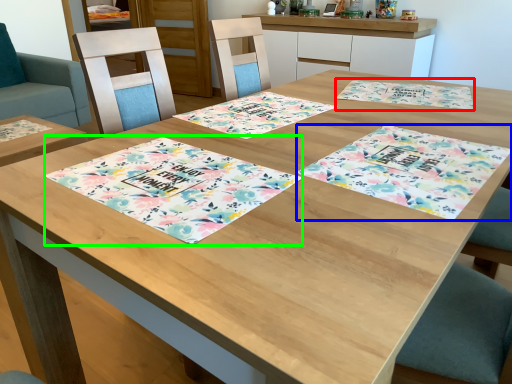
Question: Considering the real-world distances, which object is farthest from place mat (highlighted by a red box)? place mat (highlighted by a blue box) or place mat (highlighted by a green box)?

Choices:
 (A) place mat
 (B) place mat

Answer: (B)